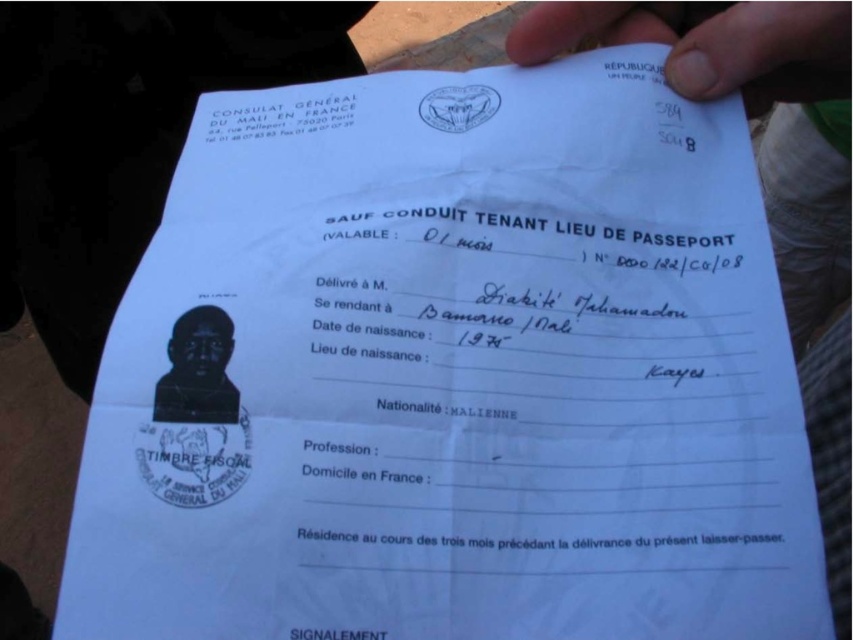
Question: Is white paper at upper center to the left of black matte passport photo at center from the viewer's perspective?

Choices:
 (A) yes
 (B) no

Answer: (B)

Question: Can you confirm if white paper at upper center is wider than black matte passport photo at center?

Choices:
 (A) yes
 (B) no

Answer: (A)

Question: Where is white paper at upper center located in relation to black matte passport photo at center in the image?

Choices:
 (A) below
 (B) above

Answer: (B)

Question: Which point is closer to the camera?

Choices:
 (A) (180, 333)
 (B) (828, 19)

Answer: (A)